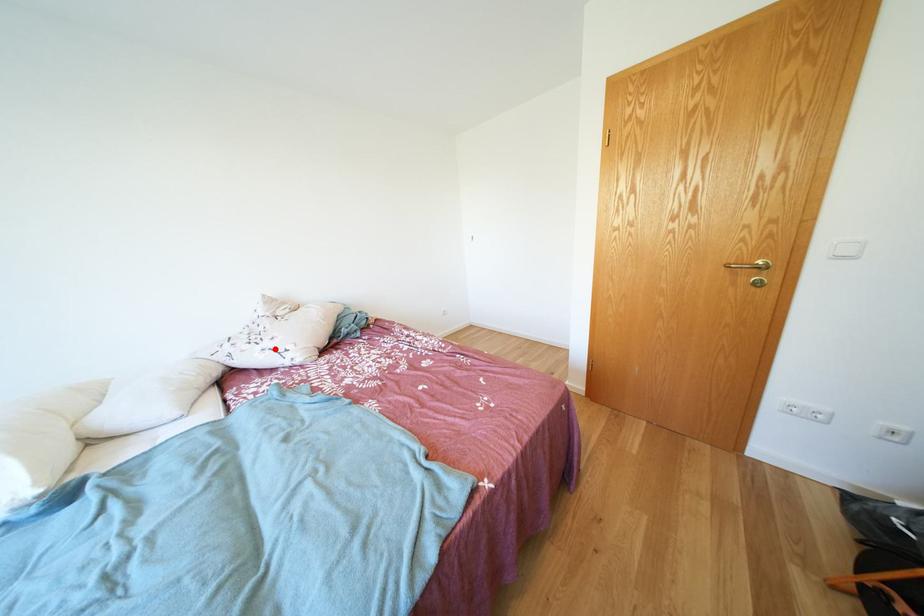
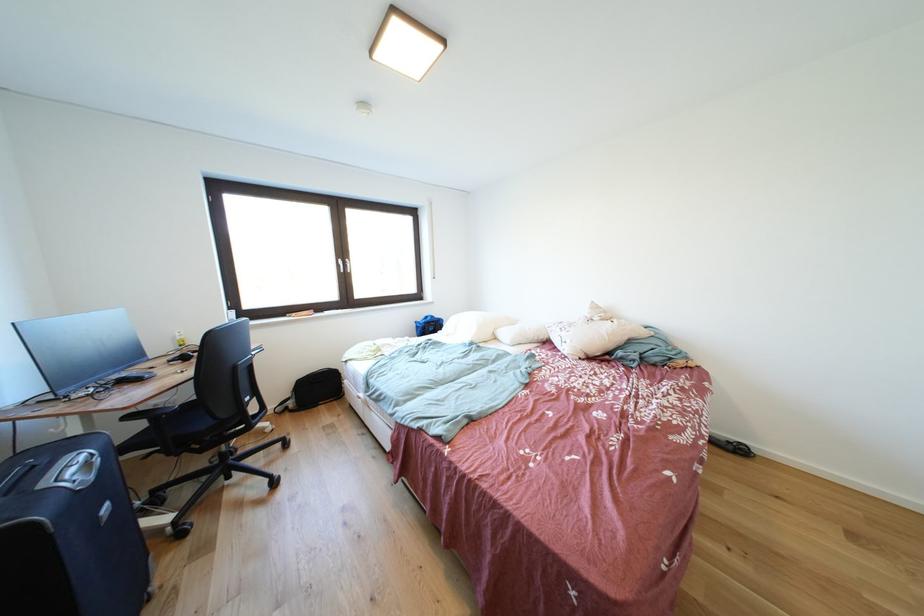
In the second image, find the point that corresponds to the highlighted location in the first image.

(572, 338)